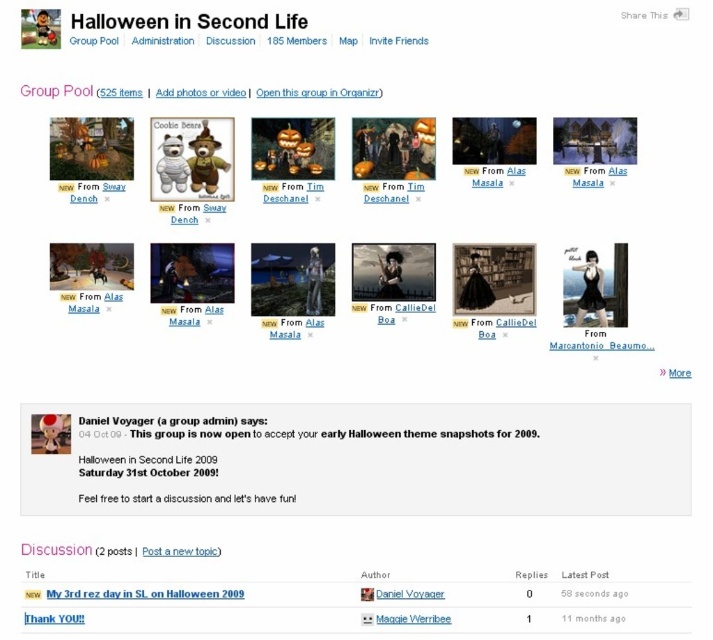
Can you confirm if matte black witch at center is wider than black matte text at upper center?

No.

Is point (391, 266) positioned after point (173, 588)?

Yes, it is.

Between point (424, 273) and point (53, 596), which one is positioned behind?

The point (424, 273) is behind.

Find the location of `matte black witch at center`. matte black witch at center is located at coordinates (391, 272).

Which of these two, matte black witch at center or gray matte text at center, stands taller?

Standing taller between the two is matte black witch at center.

Is matte black witch at center to the left of gray matte text at center from the viewer's perspective?

Yes, matte black witch at center is to the left of gray matte text at center.

What do you see at coordinates (391, 272) in the screenshot? I see `matte black witch at center` at bounding box center [391, 272].

Identify the location of matte black witch at center. The image size is (713, 640). (391, 272).

Is point (225, 595) farther from camera compared to point (436, 624)?

No, (225, 595) is closer to viewer.

Can you confirm if black matte text at upper center is thinner than gray matte text at center?

In fact, black matte text at upper center might be wider than gray matte text at center.

Does point (155, 596) lie behind point (381, 625)?

No.

Locate an element on the screen. This screenshot has width=713, height=640. black matte text at upper center is located at coordinates (143, 593).